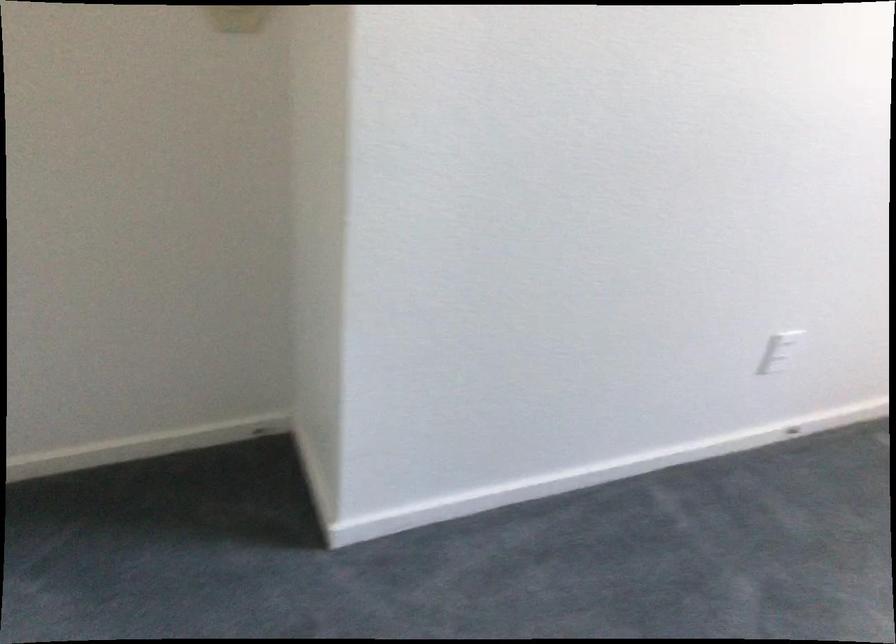
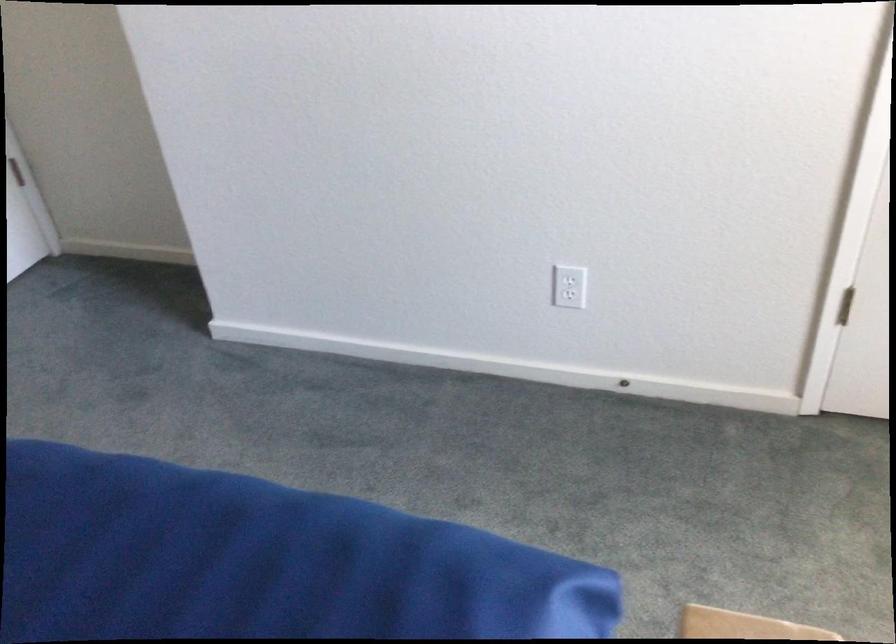
Locate, in the second image, the point that corresponds to the point at 763,362 in the first image.

(569, 295)